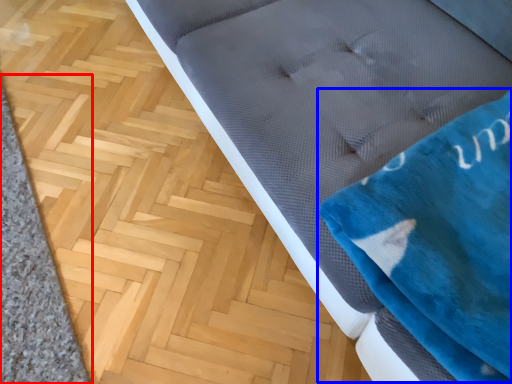
Question: Which object appears closest to the camera in this image, doormat (highlighted by a red box) or cloth (highlighted by a blue box)?

Choices:
 (A) doormat
 (B) cloth

Answer: (B)